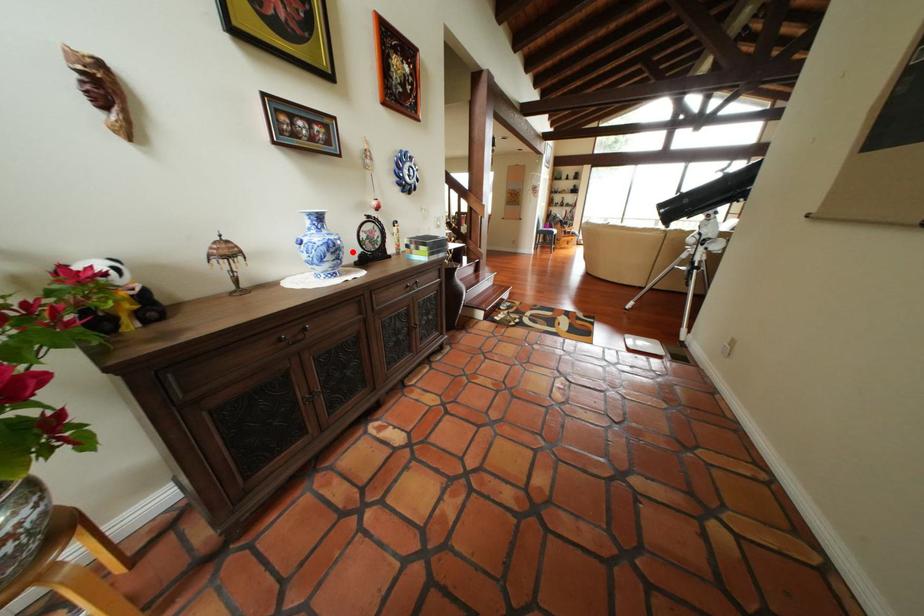
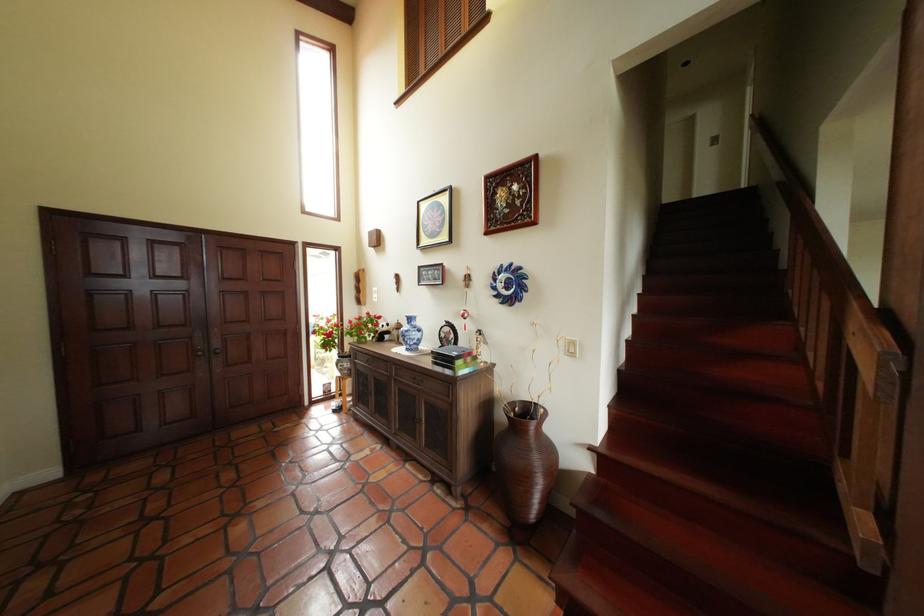
Locate, in the second image, the point that corresponds to the highlighted location in the first image.

(418, 338)